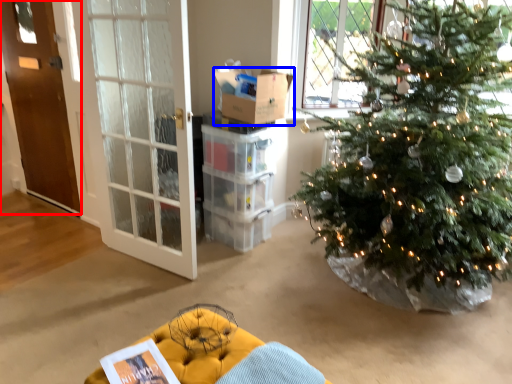
Question: Which point is closer to the camera, door (highlighted by a red box) or box (highlighted by a blue box)?

Choices:
 (A) door
 (B) box

Answer: (B)